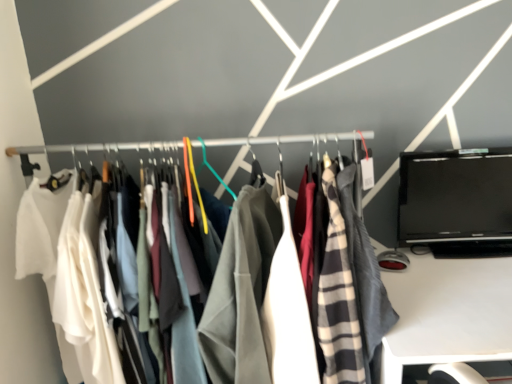
Question: Does point (74, 145) appear closer or farther from the camera than point (456, 226)?

Choices:
 (A) farther
 (B) closer

Answer: (A)

Question: In terms of size, does matte fabric clothes at center appear bigger or smaller than black glossy laptop at right?

Choices:
 (A) small
 (B) big

Answer: (B)

Question: Which object is positioned farthest from the black glossy laptop at right?

Choices:
 (A) matte fabric clothes at center
 (B) white plastic desk at lower right

Answer: (A)

Question: Estimate the real-world distances between objects in this image. Which object is farther from the matte fabric clothes at center?

Choices:
 (A) black glossy laptop at right
 (B) white plastic desk at lower right

Answer: (B)